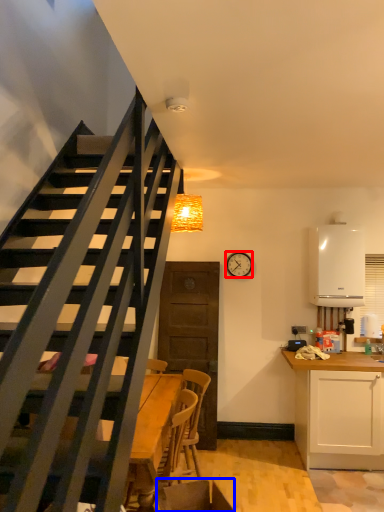
Question: Which object appears farthest to the camera in this image, clock (highlighted by a red box) or swivel chair (highlighted by a blue box)?

Choices:
 (A) clock
 (B) swivel chair

Answer: (A)